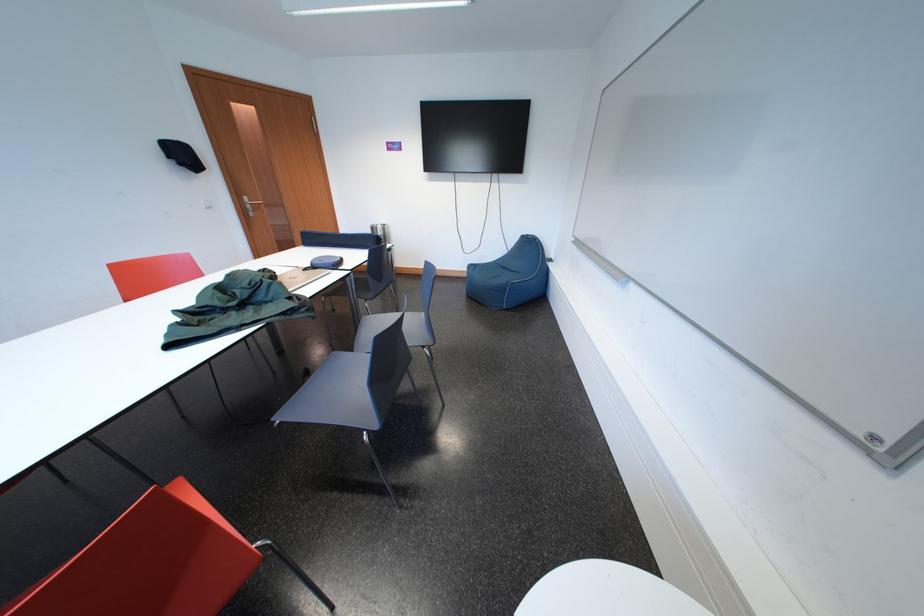
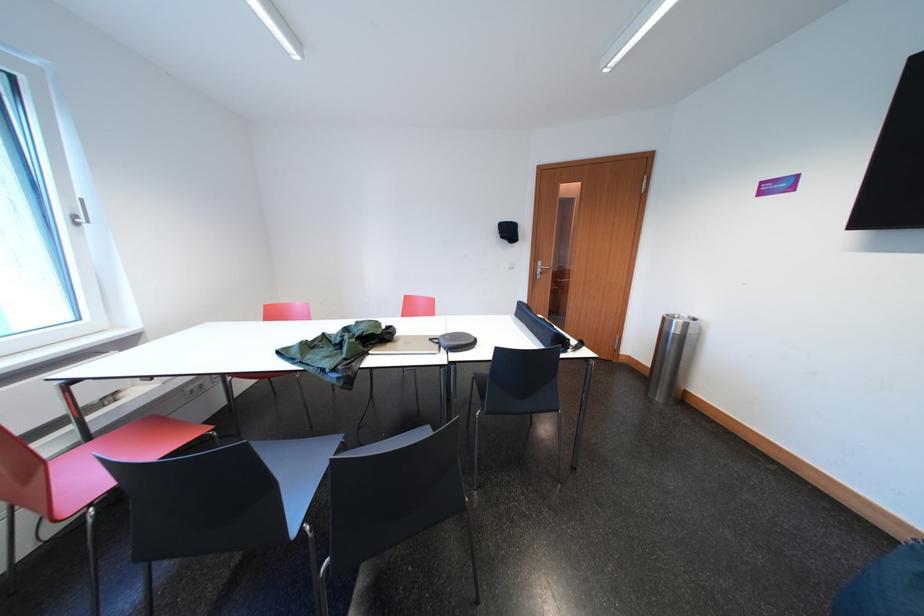
Where in the second image is the point corresponding to (254,203) from the first image?

(550, 268)